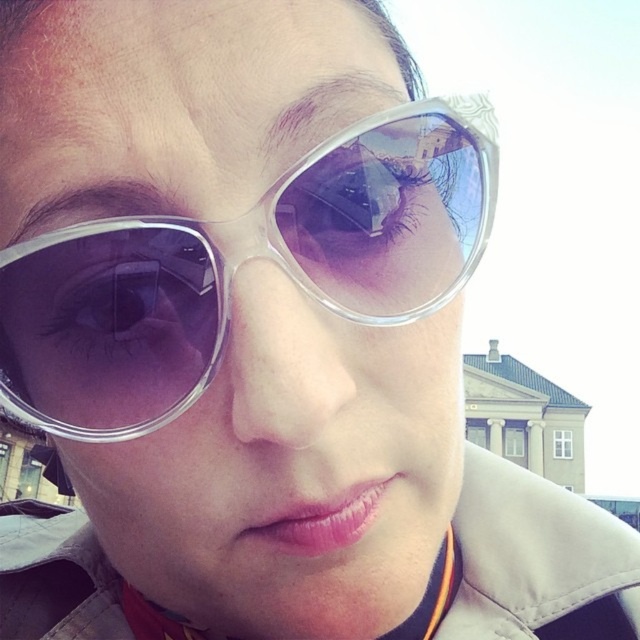
Question: Can you confirm if transparent plastic sunglasses at center is smaller than light beige fabric trench coat at center?

Choices:
 (A) yes
 (B) no

Answer: (A)

Question: Which point is closer to the camera taking this photo?

Choices:
 (A) (60, 390)
 (B) (600, 513)

Answer: (A)

Question: Which object is closer to the camera taking this photo?

Choices:
 (A) transparent plastic sunglasses at center
 (B) light beige fabric trench coat at center

Answer: (A)

Question: Is transparent plastic sunglasses at center thinner than light beige fabric trench coat at center?

Choices:
 (A) no
 (B) yes

Answer: (B)

Question: Does transparent plastic sunglasses at center have a larger size compared to light beige fabric trench coat at center?

Choices:
 (A) yes
 (B) no

Answer: (B)

Question: Which point is farther from the camera taking this photo?

Choices:
 (A) (120, 593)
 (B) (182, 237)

Answer: (A)